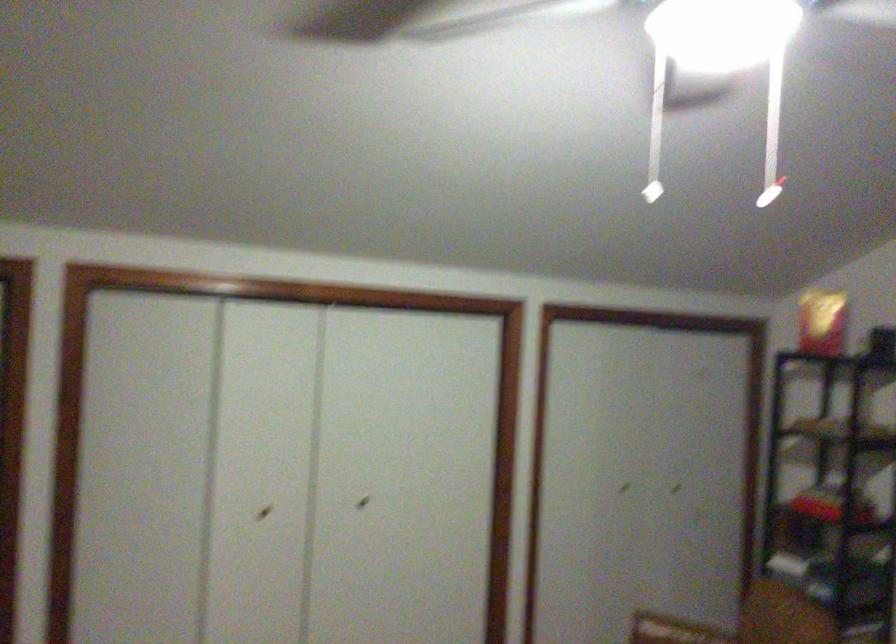
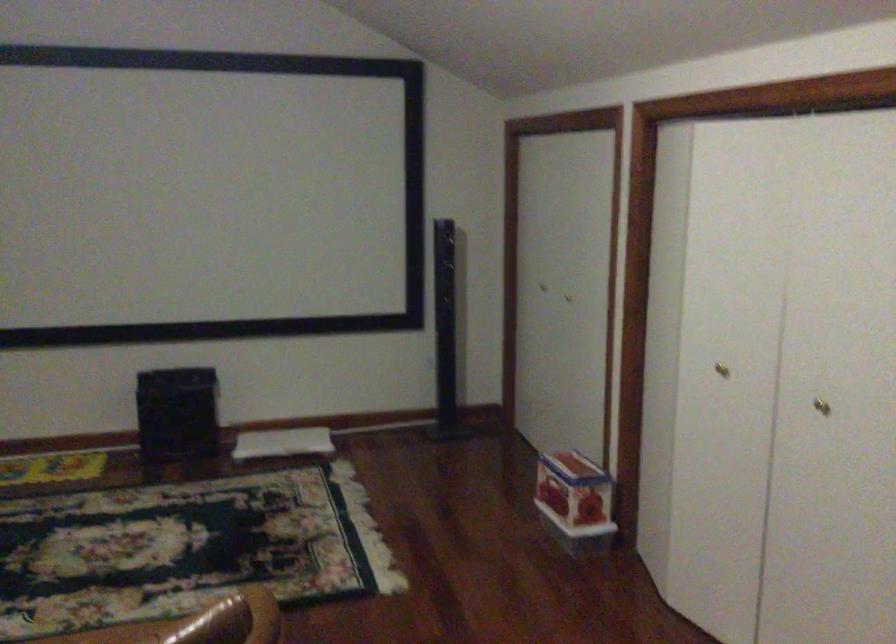
Where in the second image is the point corresponding to (x=248, y=507) from the first image?

(721, 368)